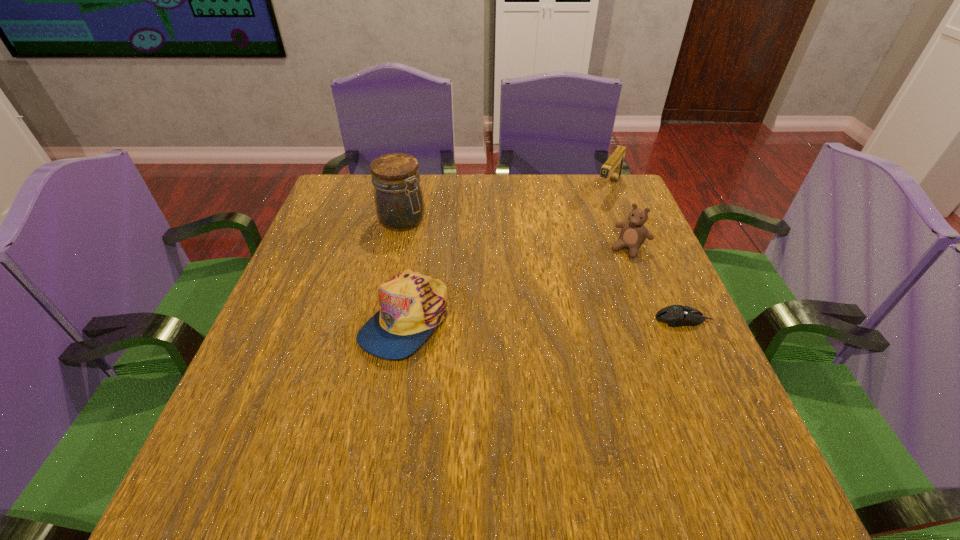
The image size is (960, 540). I want to click on vacant space that satisfies the following two spatial constraints: 1. on the front side of the farthest object; 2. on the left side of the shortest object, so click(660, 319).

I want to click on free spot that satisfies the following two spatial constraints: 1. on the front side of the third farthest object; 2. on the left side of the shortest object, so click(657, 319).

You are a GUI agent. You are given a task and a screenshot of the screen. Output one action in this format:
    pyautogui.click(x=<x>, y=<y>)
    Task: Click on the free space that satisfies the following two spatial constraints: 1. on the front side of the third farthest object; 2. on the left side of the fourth nearest object
    
    Given the screenshot: What is the action you would take?
    pyautogui.click(x=396, y=248)